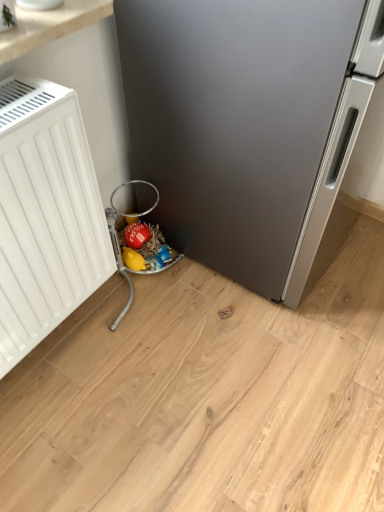
Identify the location of white matte radiator at left. (46, 215).

The width and height of the screenshot is (384, 512). What do you see at coordinates (46, 215) in the screenshot? I see `white matte radiator at left` at bounding box center [46, 215].

At what (x,y) coordinates should I click in order to perform the action: click on white matte radiator at left. Please return your answer as a coordinate pair (x, y). This screenshot has height=512, width=384. Looking at the image, I should click on (46, 215).